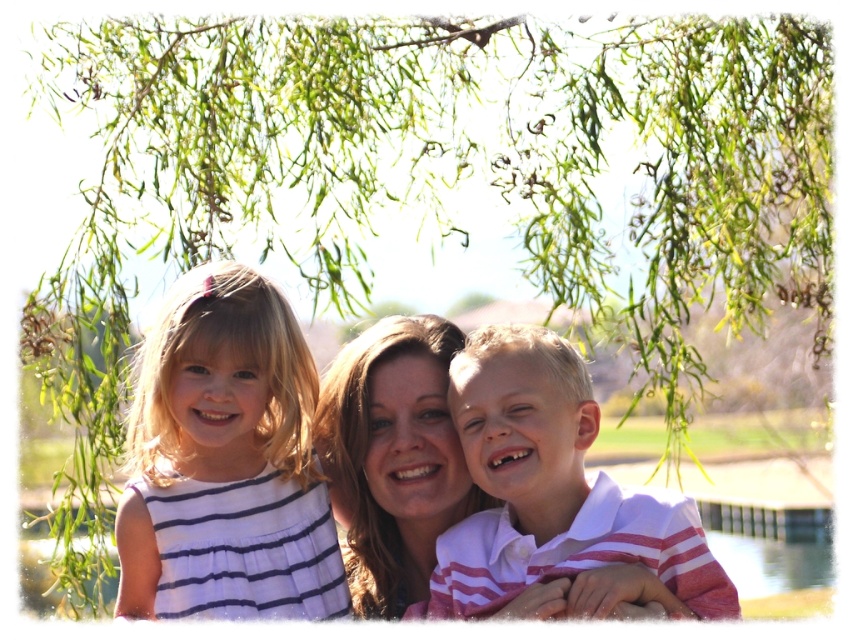
You are a photographer trying to capture a group photo of the two children and the woman. You notice the white striped dress at left and the white striped shirt at center in the scene. Which clothing item appears smaller in size?

The white striped dress at left appears smaller in size compared to the white striped shirt at center.

Looking at this image, you are a photographer trying to capture a candid shot of the two people wearing white striped clothing in the scene. Since you want to ensure both are in focus, you need to know which one is taller. Can you tell me which is taller between the white striped dress at left and the white striped shirt at center?

The white striped dress at left is taller than the white striped shirt at center.